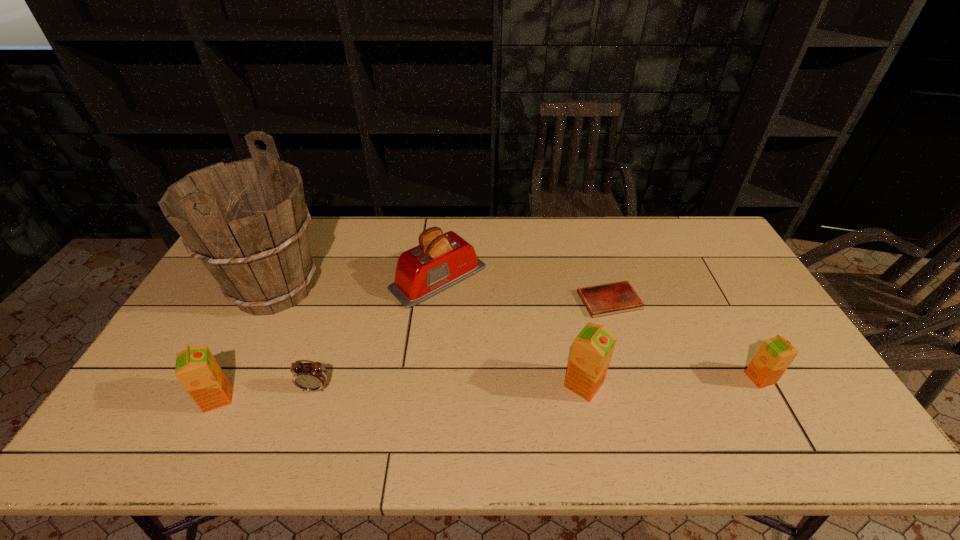
At what (x,y) coordinates should I click in order to perform the action: click on vacant space that's between the fifth tallest object and the tallest object. Please return your answer as a coordinate pair (x, y). The width and height of the screenshot is (960, 540). Looking at the image, I should click on (517, 333).

This screenshot has width=960, height=540. Find the location of `unoccupied position between the fourth object from right to left and the shortest object`. unoccupied position between the fourth object from right to left and the shortest object is located at coordinates (524, 289).

The height and width of the screenshot is (540, 960). I want to click on vacant area that lies between the bucket and the fifth object from right to left, so click(295, 338).

Identify the location of free space between the tallest object and the toaster. The width and height of the screenshot is (960, 540). (356, 284).

What are the coordinates of `free space between the tallest object and the fourth object from right to left` in the screenshot? It's located at (x=356, y=284).

Identify the location of vacant area that lies between the second shortest orange juice and the fifth tallest object. This screenshot has width=960, height=540. (489, 388).

Find the location of a particular element. The image size is (960, 540). vacant area that lies between the second orange juice from left to right and the fourth object from left to right is located at coordinates (511, 332).

Select which object appears as the fourth closest to the rightmost orange juice. Please provide its 2D coordinates. Your answer should be formatted as a tuple, i.e. [(x, y)], where the tuple contains the x and y coordinates of a point satisfying the conditions above.

[(312, 376)]

Locate which object is the second closest to the fourth object from left to right. Please provide its 2D coordinates. Your answer should be formatted as a tuple, i.e. [(x, y)], where the tuple contains the x and y coordinates of a point satisfying the conditions above.

[(312, 376)]

Locate an element on the screen. orange juice object that ranks as the second closest to the fifth tallest object is located at coordinates (x=196, y=368).